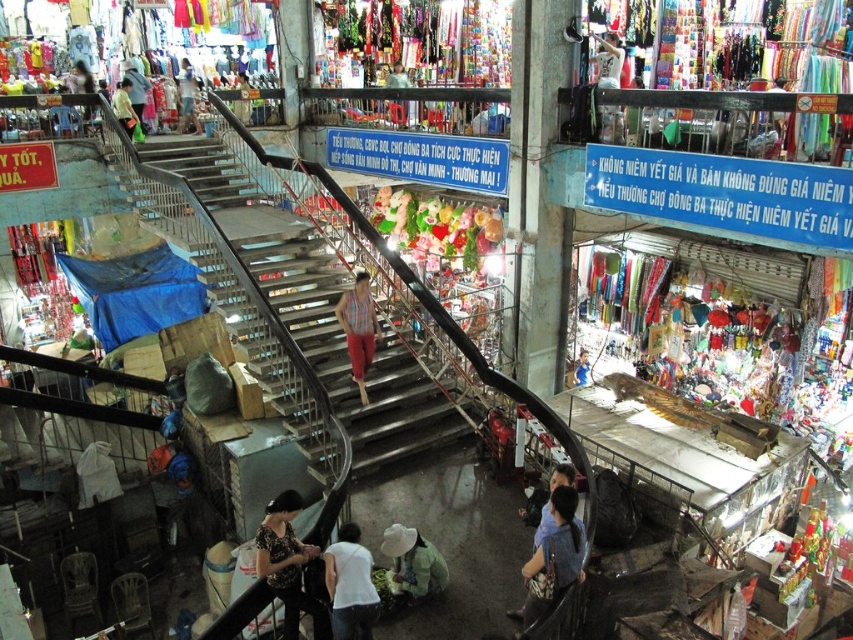
Does metallic staircase at center have a larger size compared to white matte shirt at lower center?

Correct, metallic staircase at center is larger in size than white matte shirt at lower center.

Can you confirm if metallic staircase at center is positioned above white matte shirt at lower center?

Indeed, metallic staircase at center is positioned over white matte shirt at lower center.

Is point (212, 180) more distant than point (354, 557)?

Yes.

I want to click on metallic staircase at center, so click(315, 310).

Consider the image. Can you confirm if dark floral shirt at center is positioned to the right of green fabric hat at lower center?

Incorrect, dark floral shirt at center is not on the right side of green fabric hat at lower center.

Is dark floral shirt at center shorter than green fabric hat at lower center?

Incorrect, dark floral shirt at center's height does not fall short of green fabric hat at lower center's.

I want to click on dark floral shirt at center, so click(x=288, y=564).

Locate an element on the screen. The height and width of the screenshot is (640, 853). dark floral shirt at center is located at coordinates (288, 564).

Which of these two, matte black shirt at lower center or light blue fabric at upper left, stands taller?

Standing taller between the two is light blue fabric at upper left.

Is point (558, 468) positioned in front of point (117, 84)?

Yes.

Find the location of `matte black shirt at lower center`. matte black shirt at lower center is located at coordinates (543, 524).